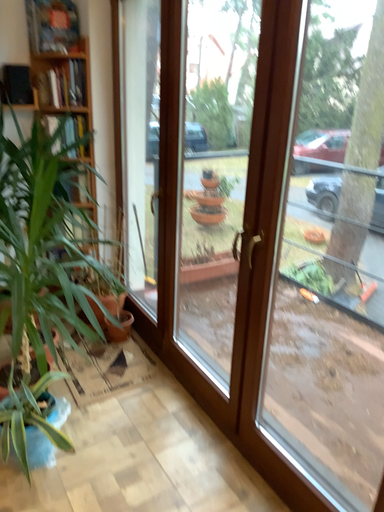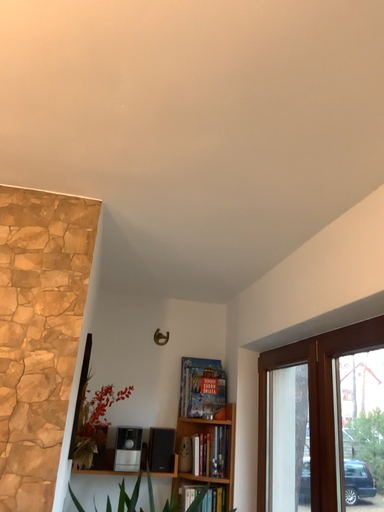
Question: Which way did the camera rotate in the video?

Choices:
 (A) rotated upward
 (B) rotated downward

Answer: (A)